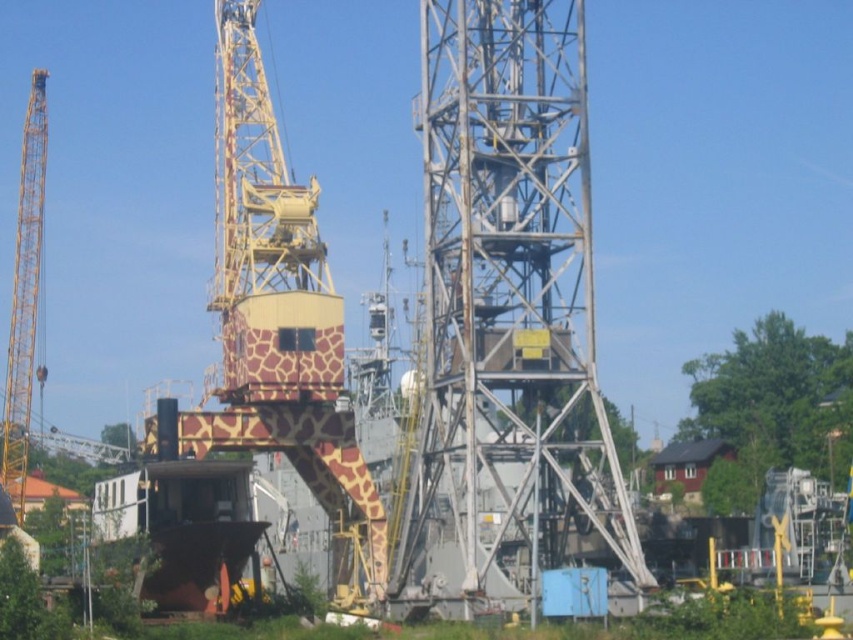
Question: From the image, what is the correct spatial relationship of metallic gray tower at center in relation to yellow metallic crane at left?

Choices:
 (A) above
 (B) below

Answer: (B)

Question: Among these points, which one is nearest to the camera?

Choices:
 (A) (216, 291)
 (B) (509, 518)

Answer: (B)

Question: Which point is farther to the camera?

Choices:
 (A) (18, 412)
 (B) (549, 616)
 (C) (585, 61)

Answer: (A)

Question: From the image, what is the correct spatial relationship of metallic gray tower at center in relation to giraffe-patterned wood at center?

Choices:
 (A) right
 (B) left

Answer: (A)

Question: Which of the following is the farthest from the observer?

Choices:
 (A) giraffe-patterned wood at center
 (B) blue painted metal lift at center
 (C) metallic gray tower at center
 (D) yellow metallic crane at left

Answer: (D)

Question: Can you confirm if giraffe-patterned wood at center is wider than yellow metallic crane at left?

Choices:
 (A) yes
 (B) no

Answer: (A)